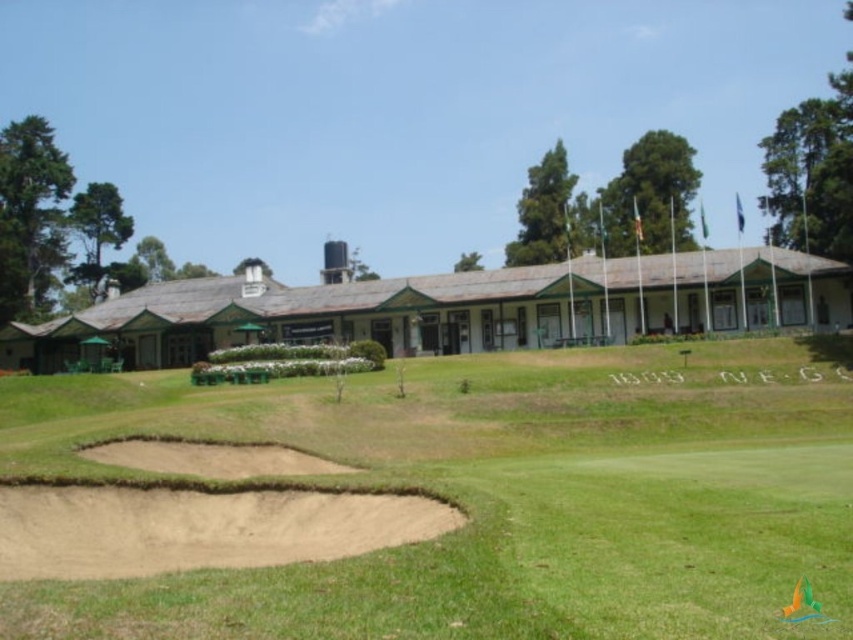
Question: Is green grassy golf course at center further to camera compared to brown sand bunker at lower left?

Choices:
 (A) no
 (B) yes

Answer: (A)

Question: Is green grassy golf course at center thinner than brown sand bunker at center?

Choices:
 (A) yes
 (B) no

Answer: (A)

Question: Considering the real-world distances, which object is farthest from the brown sand bunker at center?

Choices:
 (A) sandy beige sand trap at lower left
 (B) green grassy golf course at center
 (C) brown sand bunker at lower left

Answer: (A)

Question: Does brown sand bunker at center have a lesser width compared to brown sand bunker at lower left?

Choices:
 (A) no
 (B) yes

Answer: (A)

Question: Which point is farther to the camera?

Choices:
 (A) brown sand bunker at center
 (B) brown sand bunker at lower left
 (C) green grassy golf course at center

Answer: (A)

Question: Which is farther from the green grassy golf course at center?

Choices:
 (A) brown sand bunker at center
 (B) brown sand bunker at lower left

Answer: (A)